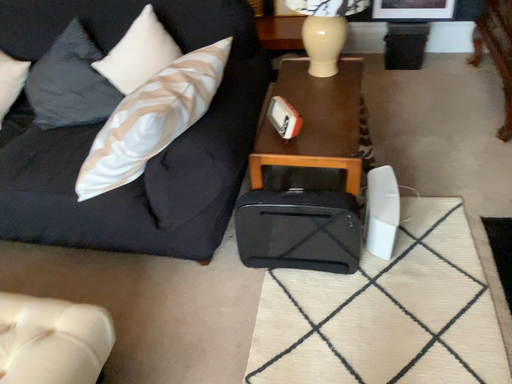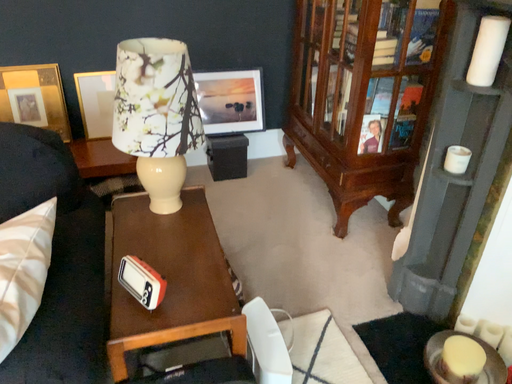
Question: How did the camera likely rotate when shooting the video?

Choices:
 (A) rotated downward
 (B) rotated upward

Answer: (B)